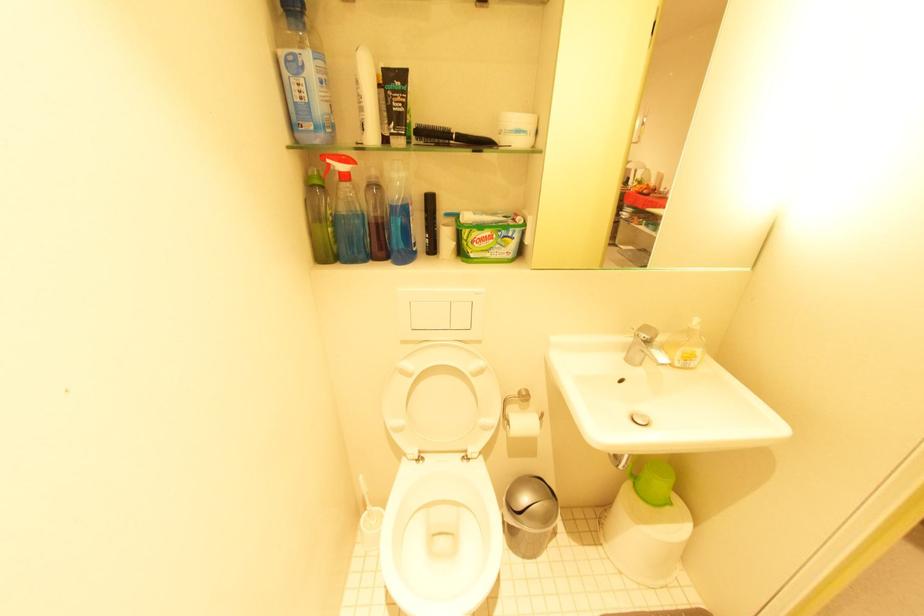
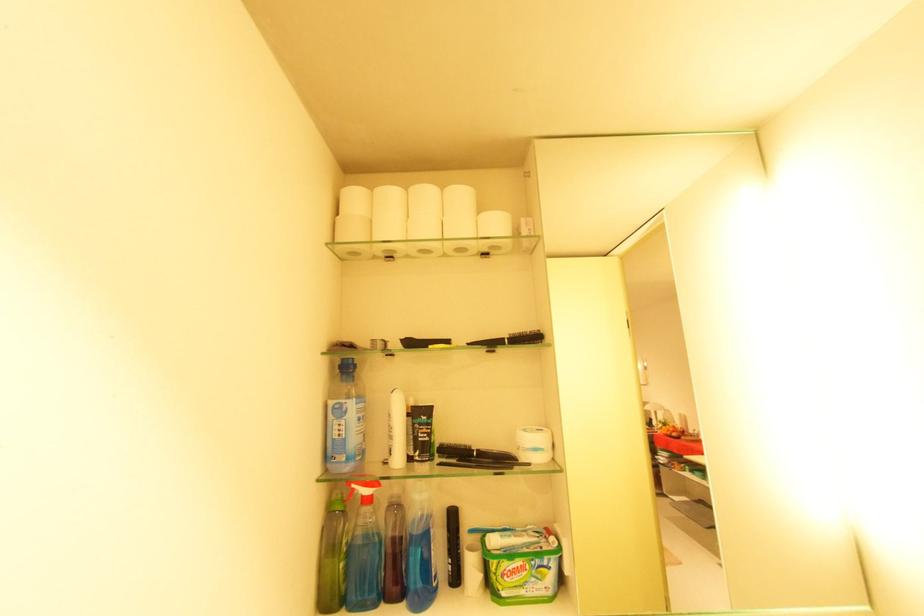
In the second image, find the point that corresponds to point 434,237 in the first image.

(457, 562)